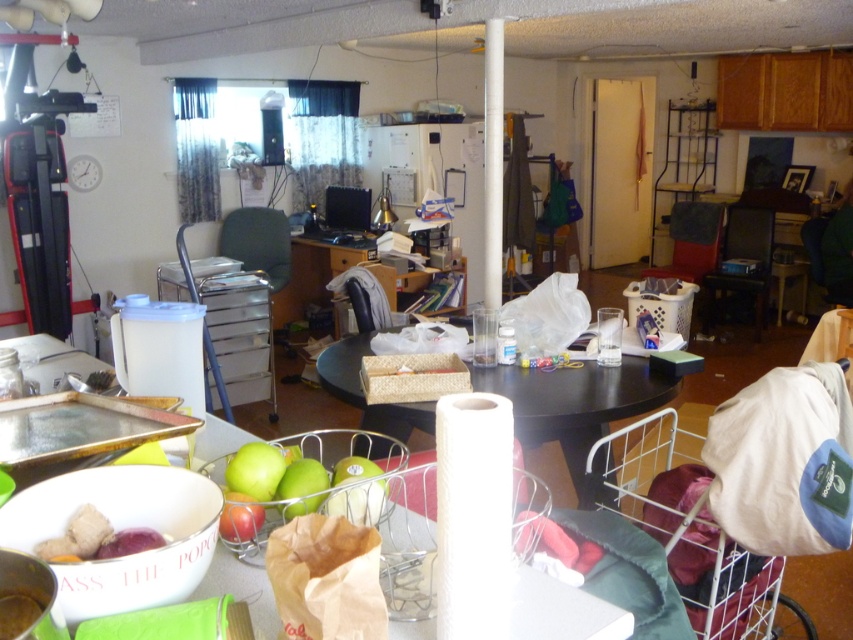
Question: Where is black matte table at center located in relation to smooth purple potato at lower left in the image?

Choices:
 (A) right
 (B) left

Answer: (A)

Question: Can you confirm if black matte table at center is positioned to the right of smooth purple potato at lower left?

Choices:
 (A) yes
 (B) no

Answer: (A)

Question: Is black matte table at center wider than smooth purple potato at lower left?

Choices:
 (A) no
 (B) yes

Answer: (B)

Question: Among these points, which one is farthest from the camera?

Choices:
 (A) (634, 374)
 (B) (107, 554)

Answer: (A)

Question: Which point appears farthest from the camera in this image?

Choices:
 (A) (368, 412)
 (B) (154, 531)

Answer: (A)